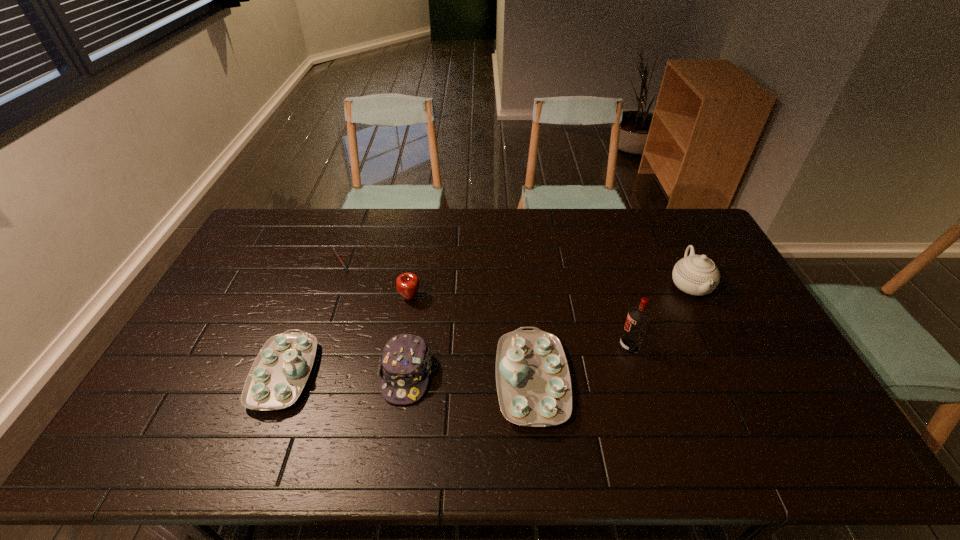
Where is `blank space located on the back of the third object from right to left`? Image resolution: width=960 pixels, height=540 pixels. blank space located on the back of the third object from right to left is located at coordinates (524, 300).

Find the location of a particular element. This screenshot has width=960, height=540. free space located 0.250m on the spout of the rightmost chinaware is located at coordinates (734, 375).

In order to click on vacant space situated 0.330m at the nib of the pen in this screenshot , I will do `click(447, 261)`.

In order to click on vacant space positioned on the front label of the sixth object from left to right in this screenshot , I will do `click(594, 346)`.

Identify the location of vacant space located on the front label of the sixth object from left to right. The width and height of the screenshot is (960, 540). (573, 346).

The width and height of the screenshot is (960, 540). I want to click on vacant space located on the front label of the sixth object from left to right, so click(503, 346).

This screenshot has width=960, height=540. I want to click on free spot located 0.050m on the left of the apple, so click(383, 298).

The width and height of the screenshot is (960, 540). I want to click on headwear that is positioned at the near edge, so click(405, 363).

At what (x,y) coordinates should I click in order to perform the action: click on object that is at the right edge. Please return your answer as a coordinate pair (x, y). Looking at the image, I should click on (697, 275).

The image size is (960, 540). In the image, there is a desktop. What are the coordinates of `vacant area at the far edge` in the screenshot? It's located at (446, 227).